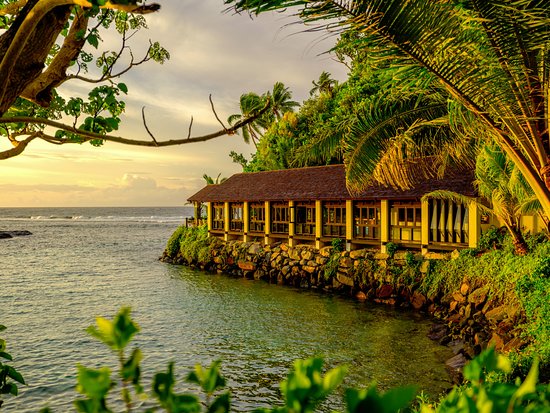
The height and width of the screenshot is (413, 550). I want to click on support column, so click(x=473, y=223), click(x=423, y=226), click(x=383, y=221), click(x=349, y=224), click(x=318, y=225), click(x=294, y=227), click(x=269, y=226), click(x=244, y=222), click(x=224, y=224), click(x=213, y=225).